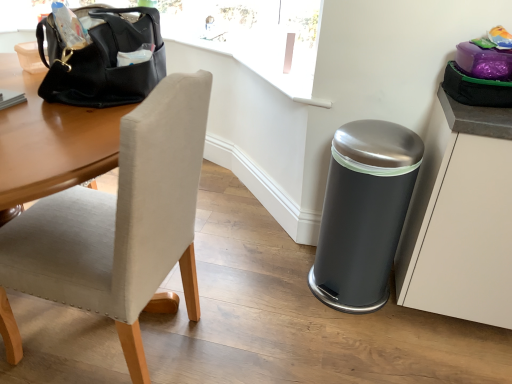
This screenshot has height=384, width=512. I want to click on free location in front of white matte cabinet at right, so click(453, 354).